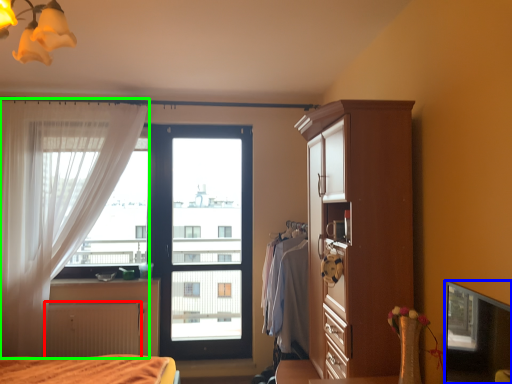
Question: Considering the real-world distances, which object is closest to radiator (highlighted by a red box)? window screen (highlighted by a blue box) or curtain (highlighted by a green box).

Choices:
 (A) window screen
 (B) curtain

Answer: (B)